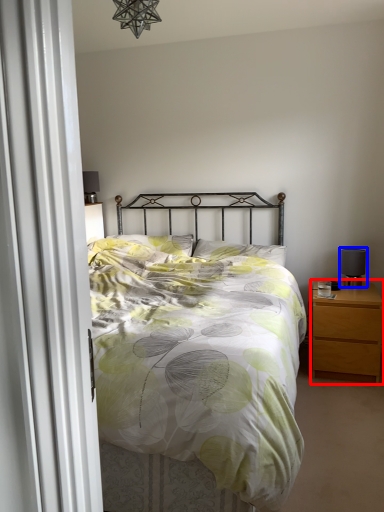
Question: Which object appears farthest to the camera in this image, nightstand (highlighted by a red box) or table lamp (highlighted by a blue box)?

Choices:
 (A) nightstand
 (B) table lamp

Answer: (B)